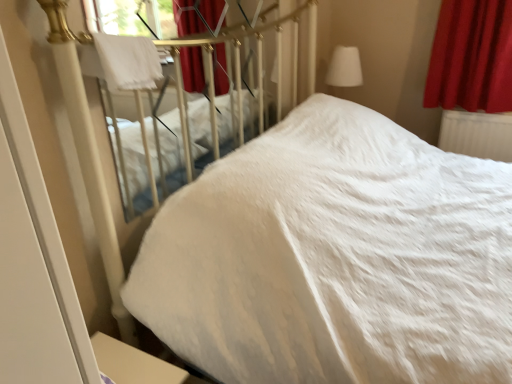
Question: Does point (264, 48) appear closer or farther from the camera than point (313, 99)?

Choices:
 (A) farther
 (B) closer

Answer: (A)

Question: Is white soft bed at upper left, which appears as the 1th bed when viewed from the left, bigger or smaller than white soft bed at center, which appears as the second bed when viewed from the left?

Choices:
 (A) big
 (B) small

Answer: (B)

Question: Which object is positioned closest to the white glossy screen door at lower left?

Choices:
 (A) white fabric lampshade at upper right
 (B) velvet red curtain at upper right
 (C) white soft bed at center, the first bed in the right-to-left sequence
 (D) white fluffy blanket at upper left
 (E) white soft bed at upper left, the second bed viewed from the right

Answer: (D)

Question: Based on their relative distances, which object is nearer to the white glossy screen door at lower left?

Choices:
 (A) white soft bed at center, which appears as the second bed when viewed from the left
 (B) white plastic radiator at right
 (C) white fluffy blanket at upper left
 (D) white soft bed at upper left, the second bed viewed from the right
 (E) velvet red curtain at upper right

Answer: (C)